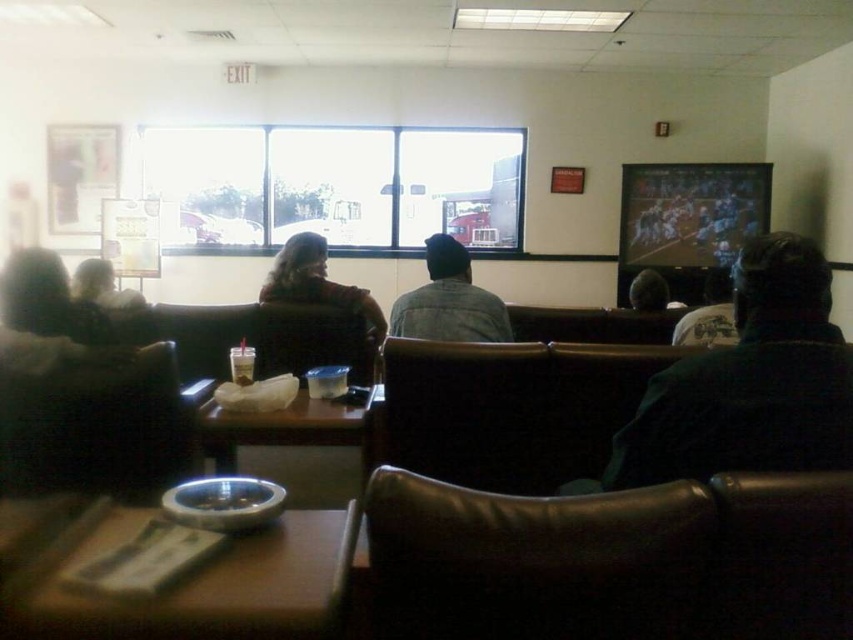
Question: Which object is farther from the camera taking this photo?

Choices:
 (A) dark brown leather jacket at center
 (B) denim jacket at center
 (C) metallic silver ashtray at lower center
 (D) dark green sweater at right

Answer: (A)

Question: Does dark green sweater at right appear on the left side of denim jacket at center?

Choices:
 (A) no
 (B) yes

Answer: (A)

Question: Which object is the closest to the dark brown leather jacket at center?

Choices:
 (A) denim jacket at center
 (B) dark gray knit cap at center
 (C) dark green sweater at right
 (D) white cotton shirt at center

Answer: (A)

Question: Does dark brown leather jacket at center have a lesser width compared to dark gray knit cap at center?

Choices:
 (A) yes
 (B) no

Answer: (B)

Question: Which of these objects is positioned farthest from the white cotton shirt at center?

Choices:
 (A) dark gray knit cap at center
 (B) denim jacket at center

Answer: (A)

Question: Observing the image, what is the correct spatial positioning of dark green sweater at right in reference to matte black jacket at left?

Choices:
 (A) above
 (B) below

Answer: (B)